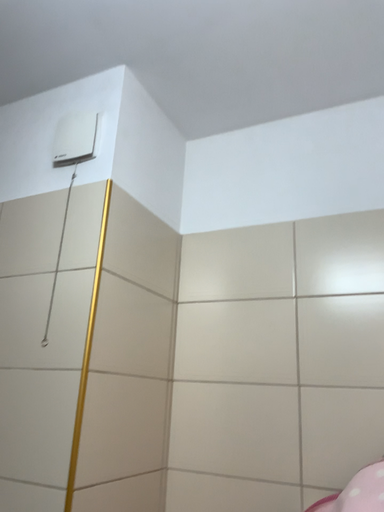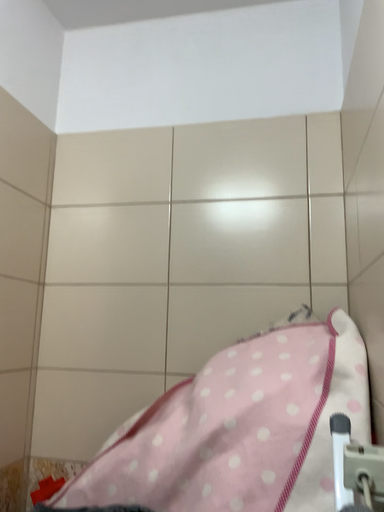
Question: How did the camera likely rotate when shooting the video?

Choices:
 (A) rotated downward
 (B) rotated upward

Answer: (A)